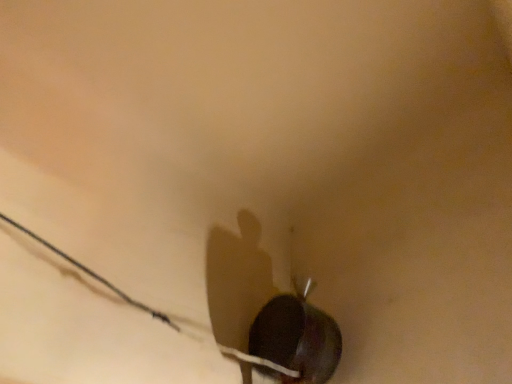
Measure the distance between point [256,336] and camera.

They are 5.52 feet apart.

In order to face glossy plastic mouse at lower center, should I rotate leftwards or rightwards?

It's best to rotate right around 4.473 degrees.

What do you see at coordinates (297, 338) in the screenshot?
I see `glossy plastic mouse at lower center` at bounding box center [297, 338].

I want to click on glossy plastic mouse at lower center, so click(x=297, y=338).

The image size is (512, 384). I want to click on glossy plastic mouse at lower center, so click(x=297, y=338).